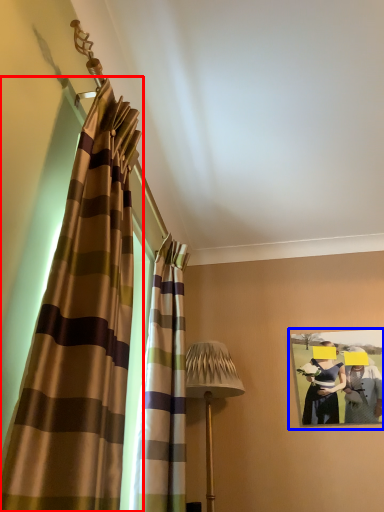
Question: Which object appears closest to the camera in this image, curtain (highlighted by a red box) or picture frame (highlighted by a blue box)?

Choices:
 (A) curtain
 (B) picture frame

Answer: (A)